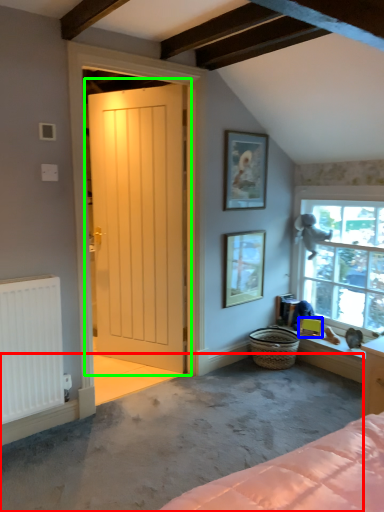
Question: Based on their relative distances, which object is farther from concrete (highlighted by a red box)? Choose from picture frame (highlighted by a blue box) and door (highlighted by a green box).

Choices:
 (A) picture frame
 (B) door

Answer: (A)